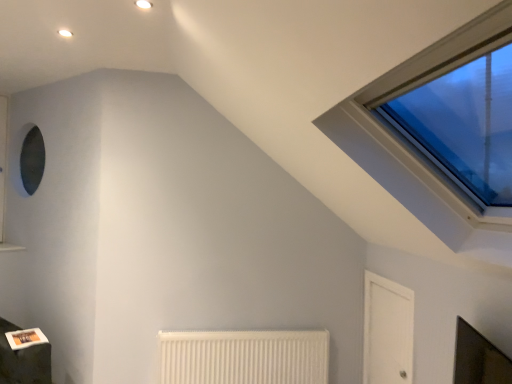
Question: Can you confirm if white ribbed radiator at lower center is taller than white glossy door at lower right?

Choices:
 (A) no
 (B) yes

Answer: (A)

Question: Is white ribbed radiator at lower center turned away from white glossy door at lower right?

Choices:
 (A) yes
 (B) no

Answer: (B)

Question: Considering the relative sizes of white ribbed radiator at lower center and white glossy door at lower right in the image provided, is white ribbed radiator at lower center shorter than white glossy door at lower right?

Choices:
 (A) yes
 (B) no

Answer: (A)

Question: From a real-world perspective, is white ribbed radiator at lower center positioned under white glossy door at lower right based on gravity?

Choices:
 (A) no
 (B) yes

Answer: (B)

Question: Does white ribbed radiator at lower center lie behind white glossy door at lower right?

Choices:
 (A) no
 (B) yes

Answer: (B)

Question: Is white ribbed radiator at lower center completely or partially outside of white glossy door at lower right?

Choices:
 (A) no
 (B) yes

Answer: (B)

Question: Does white glossy door at lower right have a greater width compared to white ribbed radiator at lower center?

Choices:
 (A) yes
 (B) no

Answer: (B)

Question: Does white glossy door at lower right contain white ribbed radiator at lower center?

Choices:
 (A) yes
 (B) no

Answer: (B)

Question: Is white glossy door at lower right to the right of white ribbed radiator at lower center from the viewer's perspective?

Choices:
 (A) yes
 (B) no

Answer: (A)

Question: Is white glossy door at lower right facing towards white ribbed radiator at lower center?

Choices:
 (A) no
 (B) yes

Answer: (B)

Question: Considering the relative sizes of white glossy door at lower right and white ribbed radiator at lower center in the image provided, is white glossy door at lower right thinner than white ribbed radiator at lower center?

Choices:
 (A) yes
 (B) no

Answer: (A)

Question: Does white glossy door at lower right have a greater height compared to white ribbed radiator at lower center?

Choices:
 (A) no
 (B) yes

Answer: (B)

Question: From a real-world perspective, is white ribbed radiator at lower center above or below white glossy door at lower right?

Choices:
 (A) below
 (B) above

Answer: (A)